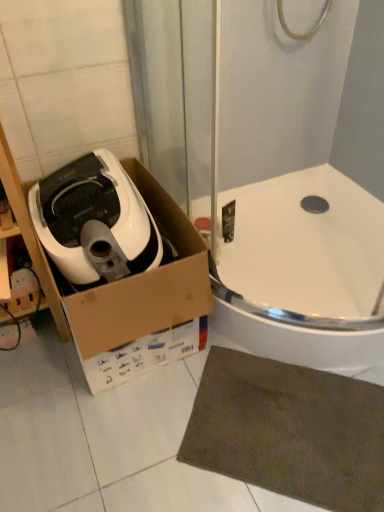
Question: Is white matte air fryer at left taller or shorter than white cardboard box at left?

Choices:
 (A) tall
 (B) short

Answer: (B)

Question: In the image, is white matte air fryer at left on the left side or the right side of white cardboard box at left?

Choices:
 (A) right
 (B) left

Answer: (B)

Question: Which object is positioned farthest from the white cardboard box at left?

Choices:
 (A) white glossy bath at center
 (B) brown textured bath mat at lower right
 (C) white matte air fryer at left

Answer: (B)

Question: Estimate the real-world distances between objects in this image. Which object is closer to the brown textured bath mat at lower right?

Choices:
 (A) white glossy bath at center
 (B) white matte air fryer at left
 (C) white cardboard box at left

Answer: (A)